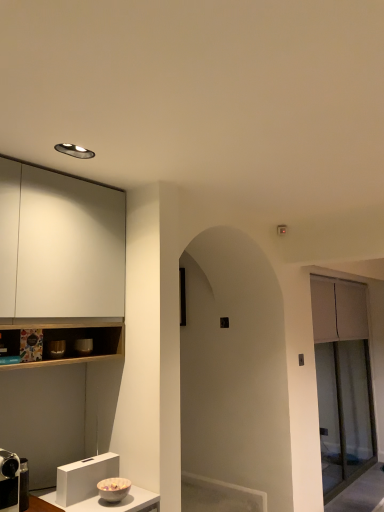
Question: Is clear glass screen door at right facing away from matte ceramic bowl at left, acting as the 2th appliance starting from the bottom?

Choices:
 (A) yes
 (B) no

Answer: (B)

Question: Does clear glass screen door at right have a lesser height compared to matte ceramic bowl at left, arranged as the 1th appliance when viewed from the right?

Choices:
 (A) no
 (B) yes

Answer: (A)

Question: Does clear glass screen door at right turn towards matte ceramic bowl at left, arranged as the 1th appliance when viewed from the right?

Choices:
 (A) yes
 (B) no

Answer: (B)

Question: Considering the relative sizes of clear glass screen door at right and matte ceramic bowl at left, arranged as the 1th appliance when viewed from the right, in the image provided, is clear glass screen door at right wider than matte ceramic bowl at left, arranged as the 1th appliance when viewed from the right,?

Choices:
 (A) yes
 (B) no

Answer: (A)

Question: Does clear glass screen door at right have a larger size compared to matte ceramic bowl at left, arranged as the 1th appliance when viewed from the right?

Choices:
 (A) no
 (B) yes

Answer: (B)

Question: In the image, is matte silver bowl at left, which appears as the second appliance when viewed from the left, positioned in front of or behind matte ceramic bowl at left, acting as the 2th appliance starting from the bottom?

Choices:
 (A) behind
 (B) front

Answer: (B)

Question: Is point click(x=52, y=346) closer or farther from the camera than point click(x=89, y=348)?

Choices:
 (A) farther
 (B) closer

Answer: (B)

Question: Would you say matte silver bowl at left, the second appliance positioned from the back, is inside or outside matte ceramic bowl at left, arranged as the second appliance when viewed from the top?

Choices:
 (A) outside
 (B) inside

Answer: (A)

Question: In terms of width, does matte silver bowl at left, acting as the 3th appliance starting from the bottom, look wider or thinner when compared to matte ceramic bowl at left, arranged as the 1th appliance when viewed from the right?

Choices:
 (A) wide
 (B) thin

Answer: (B)

Question: Is matte ceramic bowl at left, acting as the third appliance starting from the front, bigger or smaller than metallic silver camera at lower left, the 3th appliance from the back?

Choices:
 (A) small
 (B) big

Answer: (A)

Question: Choose the correct answer: Is matte ceramic bowl at left, acting as the third appliance starting from the front, inside metallic silver camera at lower left, which is the first appliance in front-to-back order, or outside it?

Choices:
 (A) inside
 (B) outside

Answer: (B)

Question: From a real-world perspective, is matte ceramic bowl at left, acting as the 2th appliance starting from the bottom, physically located above or below metallic silver camera at lower left, the third appliance from the top?

Choices:
 (A) below
 (B) above

Answer: (B)

Question: Considering their positions, is matte ceramic bowl at left, acting as the third appliance starting from the front, located in front of or behind metallic silver camera at lower left, the 3th appliance from the back?

Choices:
 (A) front
 (B) behind

Answer: (B)

Question: From a real-world perspective, is metallic silver camera at lower left, the first appliance viewed from the left, positioned above or below clear glass screen door at right?

Choices:
 (A) above
 (B) below

Answer: (B)

Question: Would you say metallic silver camera at lower left, the 3th appliance from the right, is to the left or to the right of clear glass screen door at right in the picture?

Choices:
 (A) left
 (B) right

Answer: (A)